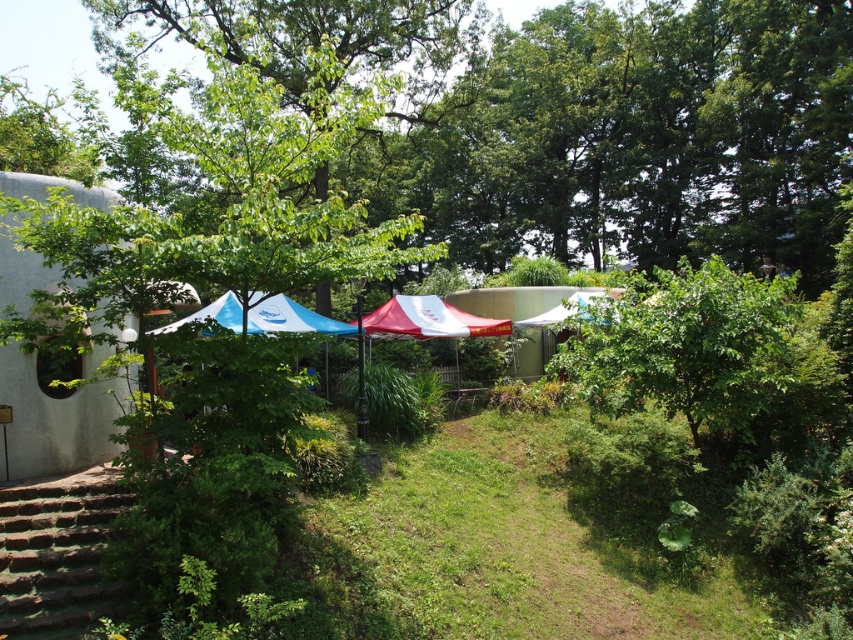
Question: Which is farther from the green grass at center?

Choices:
 (A) green leafy tree at center-right
 (B) blue fabric canopy at center

Answer: (B)

Question: Is red fabric canopy at center above blue fabric canopy at center?

Choices:
 (A) no
 (B) yes

Answer: (A)

Question: Is green grass at center below green leafy tree at center-right?

Choices:
 (A) no
 (B) yes

Answer: (B)

Question: Can you confirm if green grass at center is wider than white fabric canopy at center?

Choices:
 (A) yes
 (B) no

Answer: (B)

Question: Which of the following is the farthest from the observer?

Choices:
 (A) green grass at center
 (B) green leafy tree at center-right
 (C) white fabric canopy at center

Answer: (C)

Question: Which point is closer to the camera?

Choices:
 (A) (734, 276)
 (B) (534, 323)

Answer: (A)